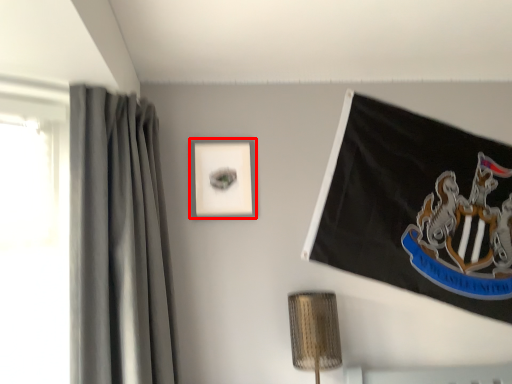
Question: From the image's perspective, where is picture frame (annotated by the red box) located in relation to curtain in the image?

Choices:
 (A) below
 (B) above

Answer: (B)